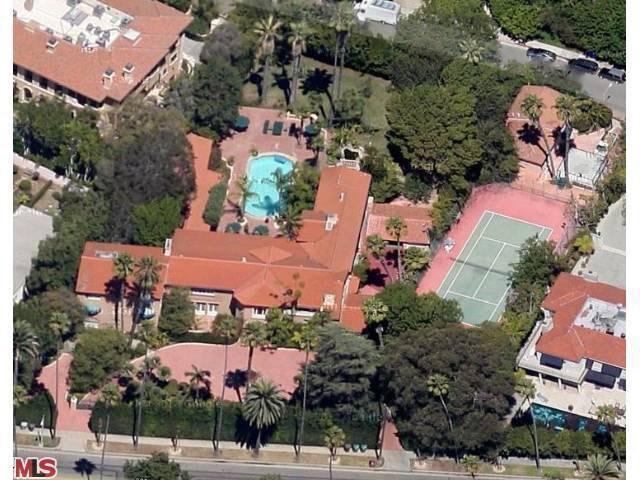
This screenshot has height=480, width=640. In order to click on trashcans in this screenshot , I will do (365, 448), (356, 447), (347, 448).